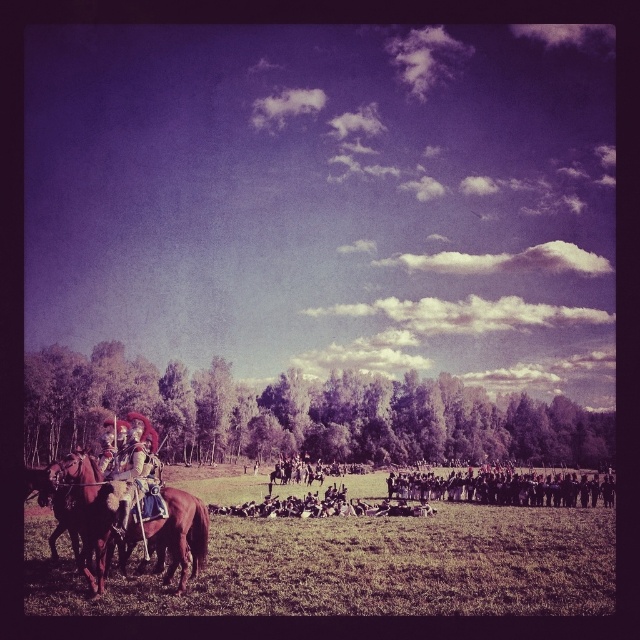
Question: Is brown leather horse at left further to camera compared to black uniformed soldiers at center?

Choices:
 (A) yes
 (B) no

Answer: (B)

Question: Estimate the real-world distances between objects in this image. Which object is closer to the black uniformed soldiers at center?

Choices:
 (A) brown leather horse at lower left
 (B) green grass at center

Answer: (B)

Question: Which object is positioned farthest from the brown leather horse at lower left?

Choices:
 (A) brown leather horse at left
 (B) green grass at center
 (C) shiny gold armor at left
 (D) black uniformed soldiers at center

Answer: (D)

Question: Among these objects, which one is farthest from the camera?

Choices:
 (A) brown leather horse at lower left
 (B) brown leather horse at left
 (C) shiny gold armor at left
 (D) black uniformed soldiers at center

Answer: (D)

Question: Does black uniformed soldiers at center appear on the left side of brown leather horse at lower left?

Choices:
 (A) yes
 (B) no

Answer: (B)

Question: Is green grass at center above black uniformed soldiers at center?

Choices:
 (A) yes
 (B) no

Answer: (A)